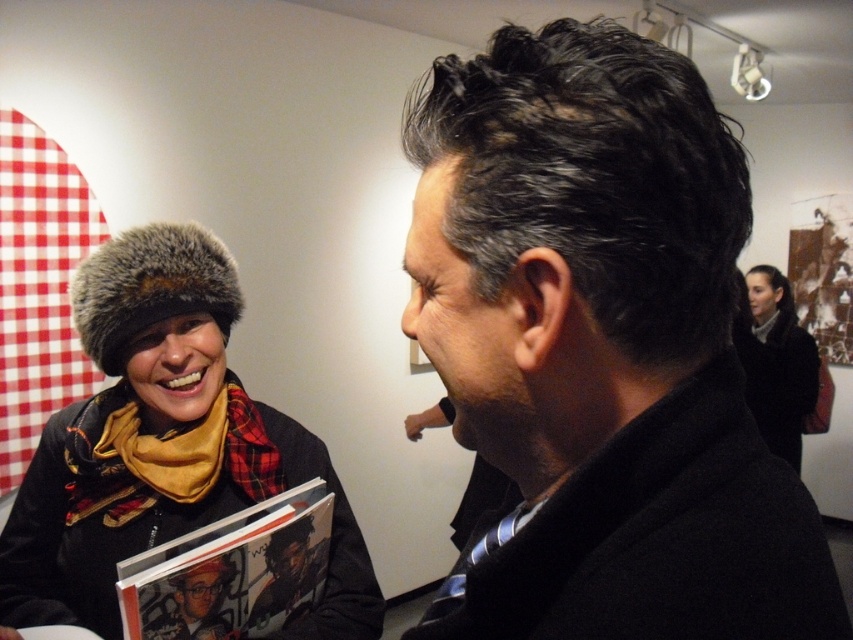
Which of these two, black wool coat at upper right or black wool coat at right, stands taller?

black wool coat at right

The height and width of the screenshot is (640, 853). Describe the element at coordinates (601, 349) in the screenshot. I see `black wool coat at upper right` at that location.

This screenshot has width=853, height=640. What are the coordinates of `black wool coat at upper right` in the screenshot? It's located at (601, 349).

Which is behind, point (189, 596) or point (759, 388)?

The point (759, 388) is more distant.

Looking at this image, can you confirm if white glossy book at lower left is bigger than black wool coat at right?

Actually, white glossy book at lower left might be smaller than black wool coat at right.

Which is in front, point (170, 593) or point (751, 396)?

Positioned in front is point (170, 593).

Locate an element on the screen. This screenshot has height=640, width=853. white glossy book at lower left is located at coordinates (231, 572).

Does black wool coat at right appear under matte black book at center?

Incorrect, black wool coat at right is not positioned below matte black book at center.

Does black wool coat at right appear on the right side of matte black book at center?

Yes, black wool coat at right is to the right of matte black book at center.

Does point (811, 400) come in front of point (323, 545)?

No, it is behind (323, 545).

Find the location of a particular element. Image resolution: width=853 pixels, height=640 pixels. black wool coat at right is located at coordinates (775, 362).